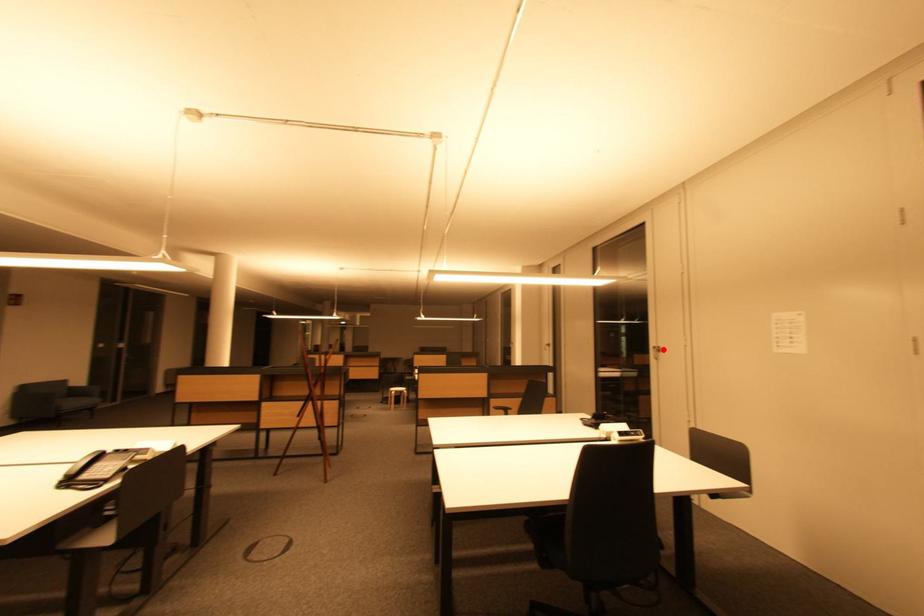
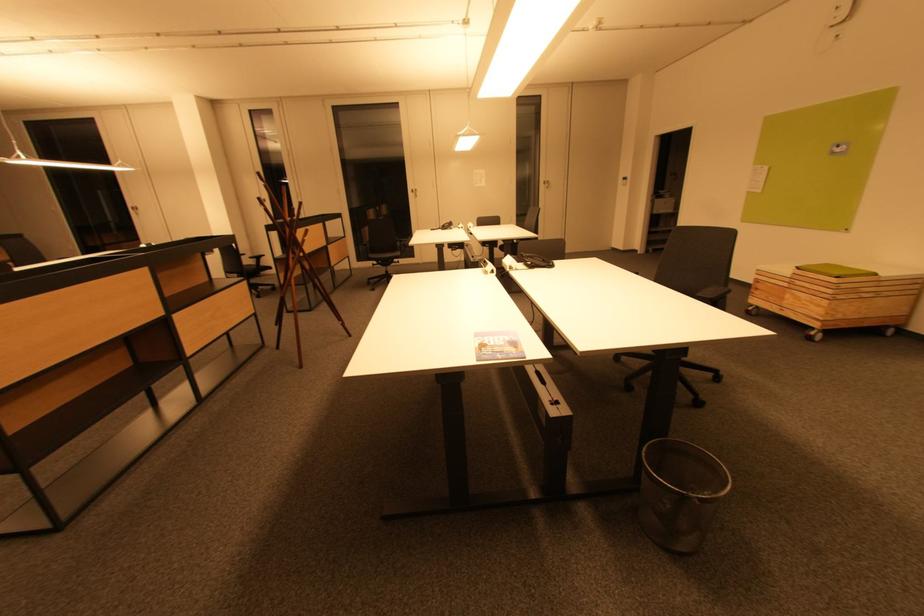
Find the pixel in the second image that matches the highlighted location in the first image.

(419, 191)